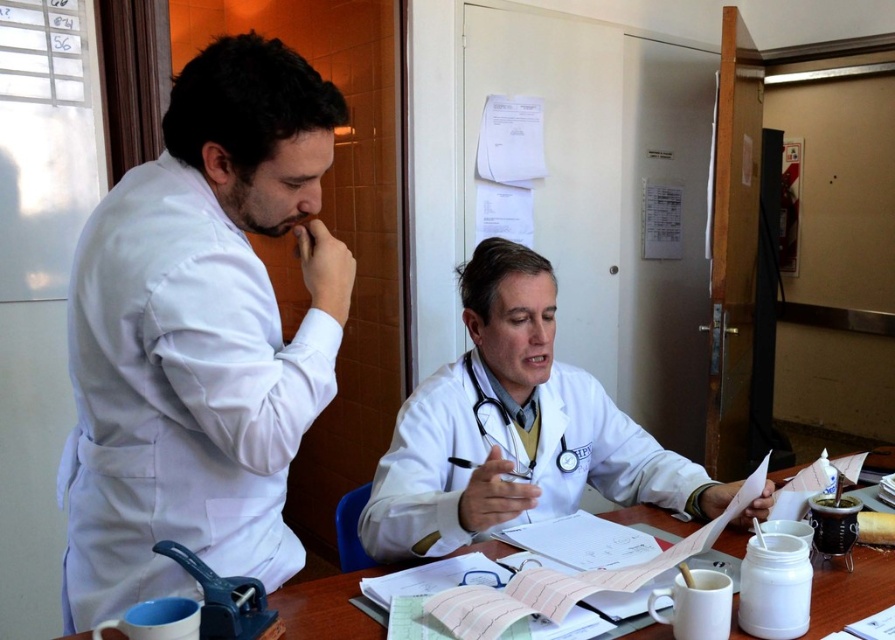
Question: Among these points, which one is nearest to the camera?

Choices:
 (A) (471, 257)
 (B) (501, 413)
 (C) (840, 580)
 (D) (95, 356)

Answer: (D)

Question: Where is white matte coat at center located in relation to wooden table at center in the image?

Choices:
 (A) below
 (B) above

Answer: (B)

Question: Among these objects, which one is nearest to the camera?

Choices:
 (A) white matte coat at center
 (B) wooden table at center
 (C) white matte lab coat at left
 (D) white rubber stethoscope at center

Answer: (C)

Question: Is white matte lab coat at left behind white rubber stethoscope at center?

Choices:
 (A) no
 (B) yes

Answer: (A)

Question: Is white matte lab coat at left above white rubber stethoscope at center?

Choices:
 (A) yes
 (B) no

Answer: (A)

Question: Based on their relative distances, which object is farther from the wooden table at center?

Choices:
 (A) white matte coat at center
 (B) white rubber stethoscope at center
 (C) white matte lab coat at left

Answer: (C)